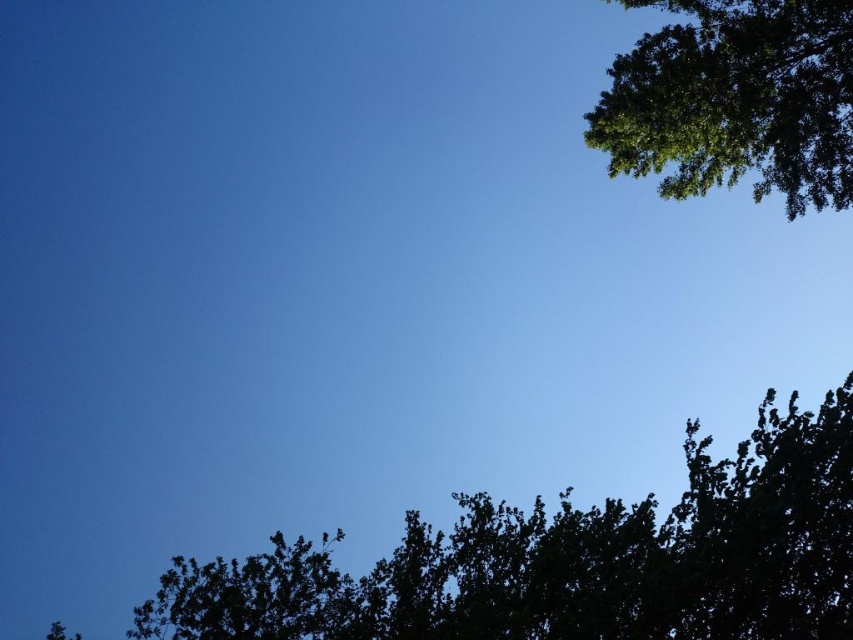
Question: Can you confirm if dark green leafy tree at lower center is positioned to the left of green leafy tree at upper right?

Choices:
 (A) yes
 (B) no

Answer: (A)

Question: Which point is farther to the camera?

Choices:
 (A) dark green leafy tree at lower center
 (B) green leafy tree at upper right

Answer: (B)

Question: Is dark green leafy tree at lower center positioned behind green leafy tree at upper right?

Choices:
 (A) yes
 (B) no

Answer: (B)

Question: Which object is closer to the camera taking this photo?

Choices:
 (A) dark green leafy tree at lower center
 (B) green leafy tree at upper right

Answer: (A)

Question: From the image, what is the correct spatial relationship of dark green leafy tree at lower center in relation to green leafy tree at upper right?

Choices:
 (A) above
 (B) below

Answer: (B)